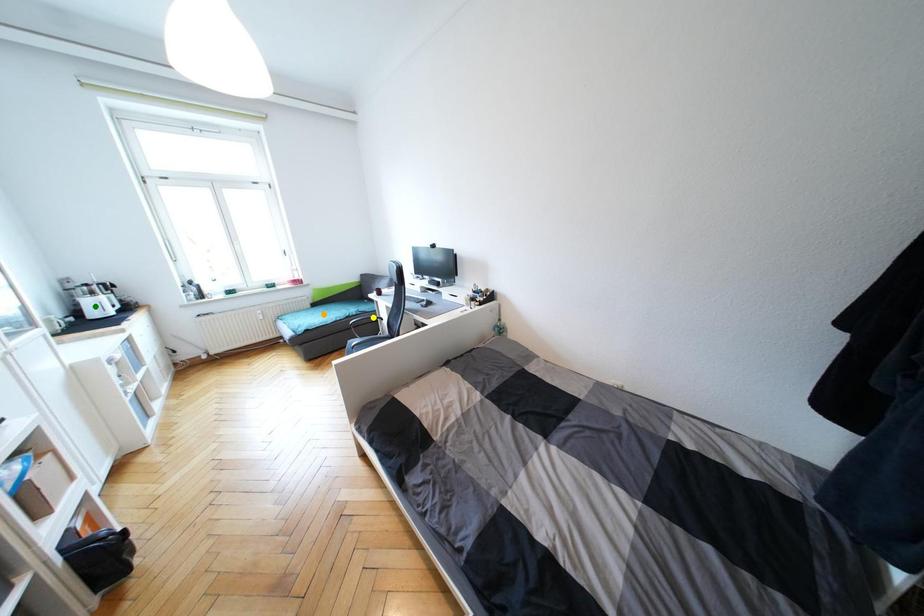
Order these from nearest to farthest:
orange point | green point | yellow point

1. green point
2. yellow point
3. orange point